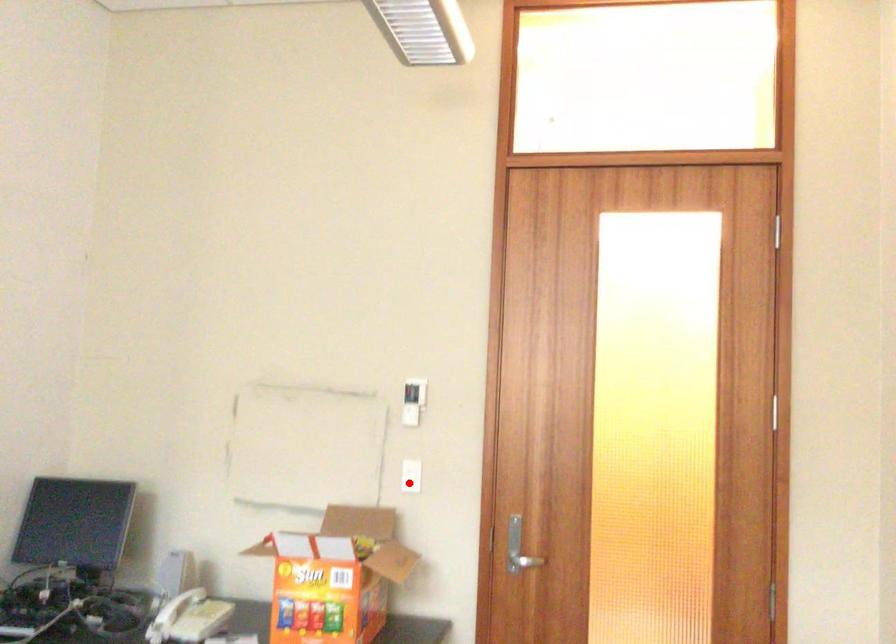
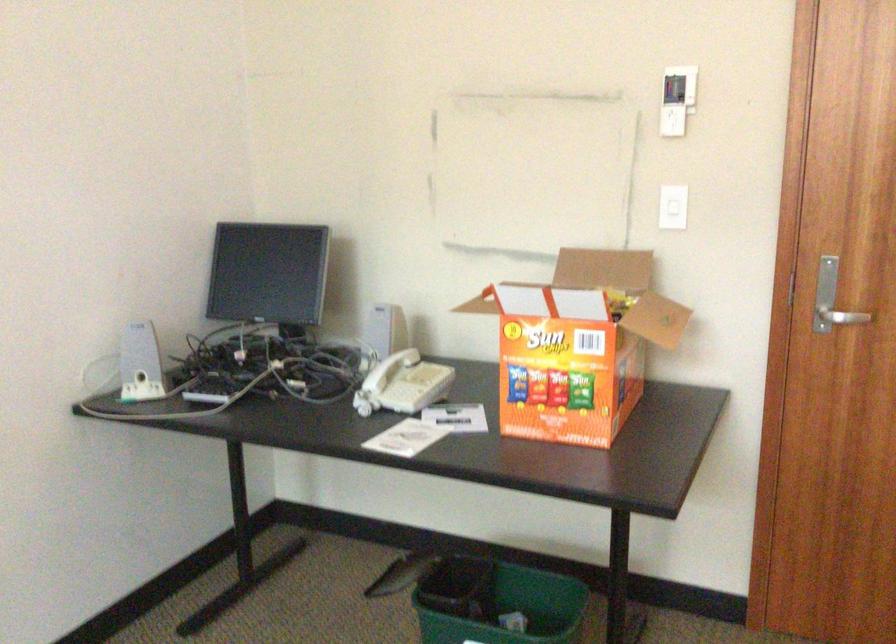
Question: I am providing you with two images of the same scene from different viewpoints. A red point is shown in image1. For the corresponding object point in image2, is it positioned nearer or farther from the camera?

Choices:
 (A) Nearer
 (B) Farther

Answer: (A)